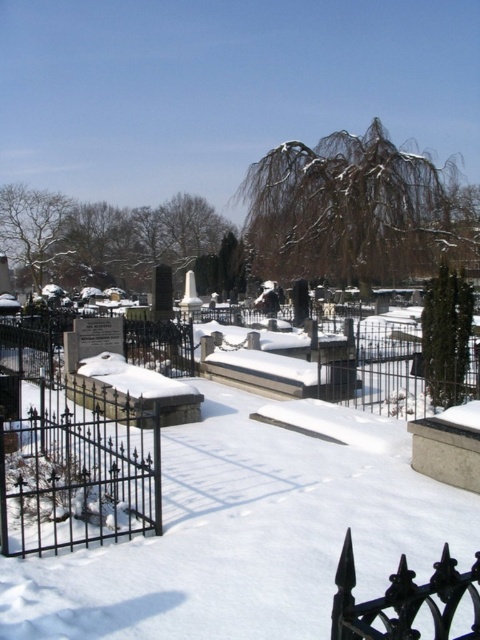
You are standing at the edge of the cemetery and want to walk towards the white powdery snow at center. However, there is a black wrought iron fence at lower right in your path. Can you step over the fence to reach the snow?

The white powdery snow at center is taller than the black wrought iron fence at lower right. Since the snow is taller, it means the fence is lower, so you can step over the black wrought iron fence at lower right to reach the white powdery snow at center.